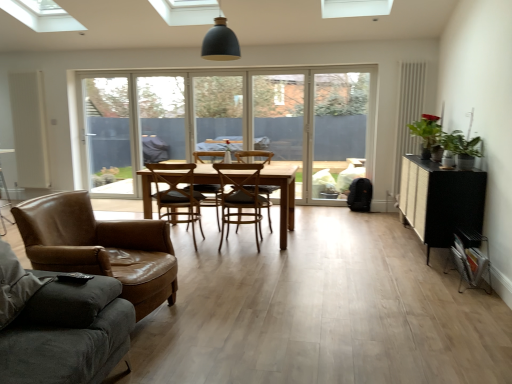
The height and width of the screenshot is (384, 512). I want to click on vacant point to the right of brown leather armchair at left, the first chair positioned from the front, so click(224, 320).